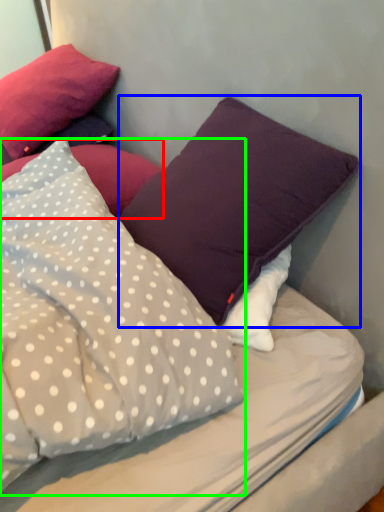
Question: Estimate the real-world distances between objects in this image. Which object is closer to pillow (highlighted by a red box), pillow (highlighted by a blue box) or pillow (highlighted by a green box)?

Choices:
 (A) pillow
 (B) pillow

Answer: (A)